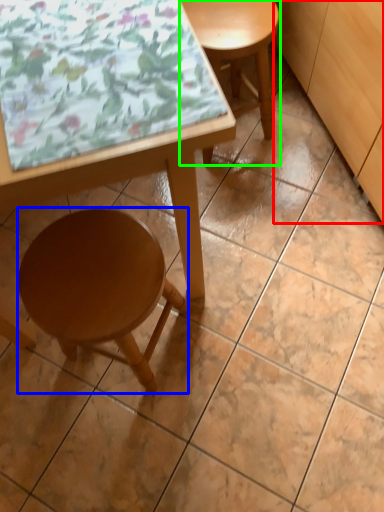
Question: Which object is the farthest from cabinetry (highlighted by a red box)? Choose among these: stool (highlighted by a blue box) or stool (highlighted by a green box).

Choices:
 (A) stool
 (B) stool

Answer: (A)